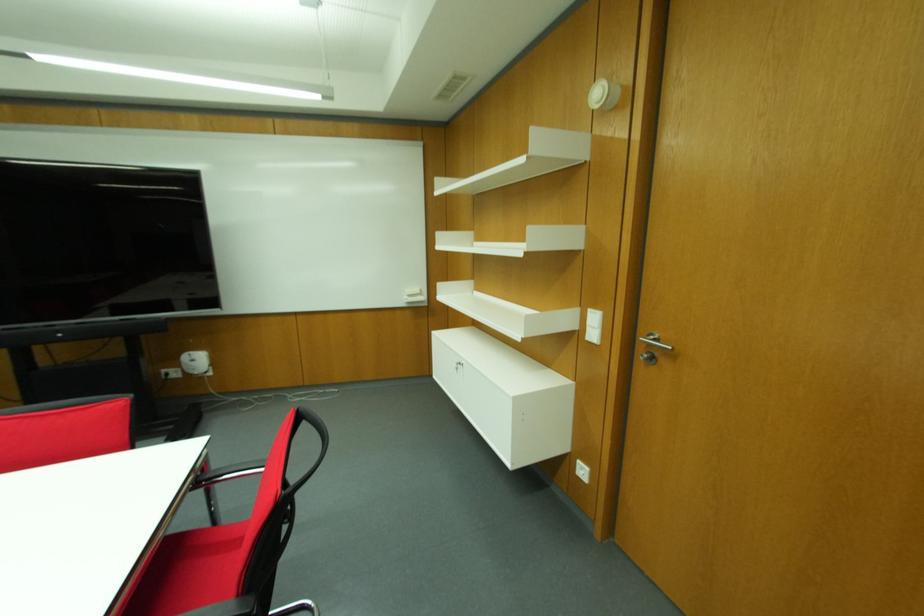
Where is `red chair sitting surface`? The width and height of the screenshot is (924, 616). red chair sitting surface is located at coordinates (188, 573).